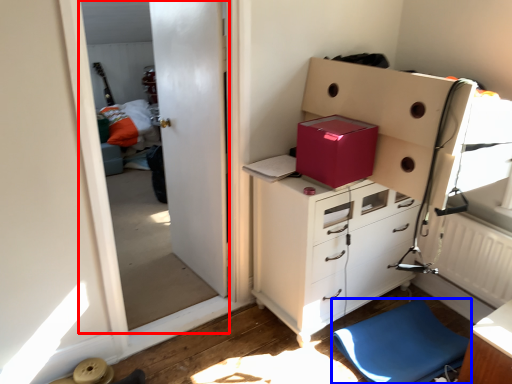
Question: Which of the following is the closest to the observer, screen door (highlighted by a red box) or furniture (highlighted by a blue box)?

Choices:
 (A) screen door
 (B) furniture

Answer: (A)